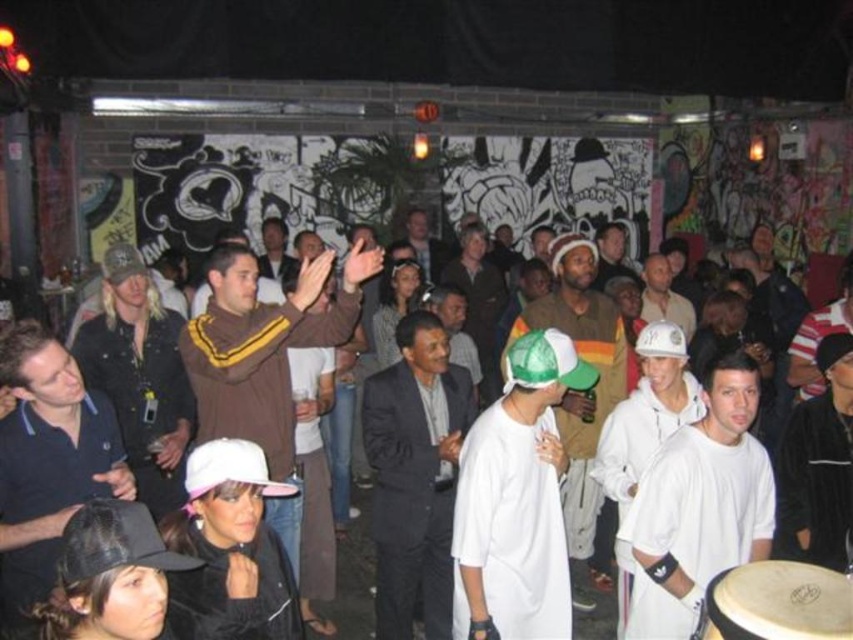
You are standing at the center of the room and want to move towards the smooth brown drum at lower right. Which direction should you move to reach it?

Since the smooth brown drum at lower right is located at point 0.913 on the y and 0.942 on the x, you should move towards the lower right direction to reach it.

You are a photographer standing at the back of the venue. You want to take a photo that includes both the brown fleece jacket at center and the white matte baseball cap at center. What is the minimum distance you need to move forward to ensure both objects are in frame?

The minimum distance you need to move forward is 5.13 feet to ensure both the brown fleece jacket at center and the white matte baseball cap at center are in frame.